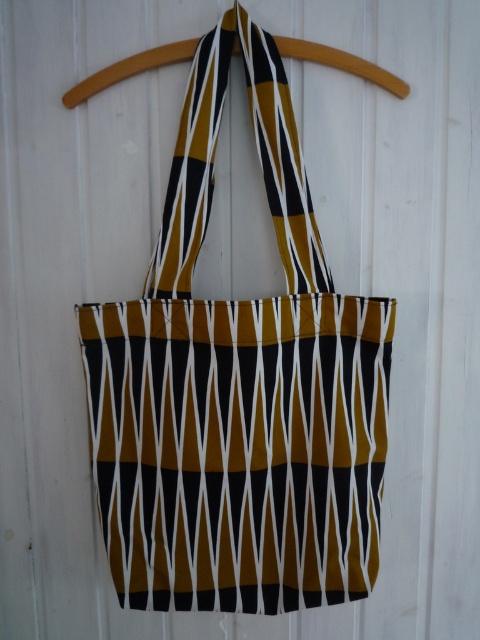
Based on the photo, you are trying to determine if the mustard and black striped tote at center is visible through the wooden hanger at center. Based on the scene description, can you see the tote behind the hanger?

The mustard and black striped tote at center is in front of wooden hanger at center, so the tote is in front and visible, not behind the hanger.

You are an interior designer planning to place a decorative item next to the mustard and black striped tote at center and the wooden hanger at center. Based on their widths, which object should you choose to ensure it doesn

The mustard and black striped tote at center has a lesser width compared to wooden hanger at center, so you should choose the wooden hanger at center to ensure it is wider and provides a better base for the decorative item.